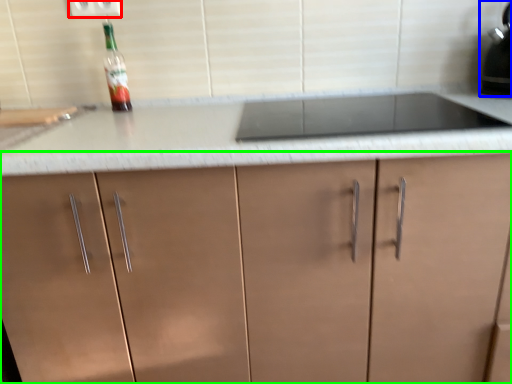
Question: Which is nearer to the electric outlet (highlighted by a red box)? kitchen appliance (highlighted by a blue box) or cabinetry (highlighted by a green box).

Choices:
 (A) kitchen appliance
 (B) cabinetry

Answer: (B)